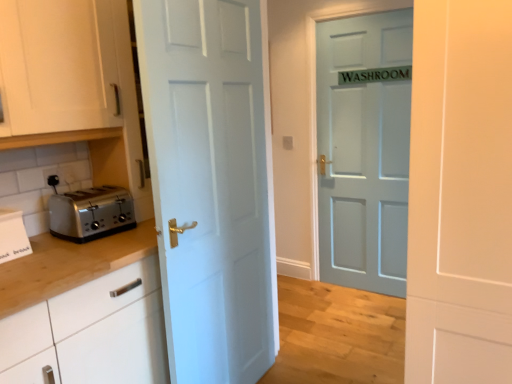
I want to click on free point in front of light blue matte door at center, the 1th door positioned from the back, so click(x=365, y=307).